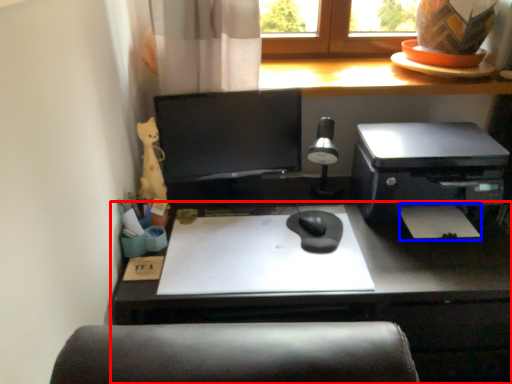
Question: Which object is further to the camera taking this photo, desk (highlighted by a red box) or notepad (highlighted by a blue box)?

Choices:
 (A) desk
 (B) notepad

Answer: (B)